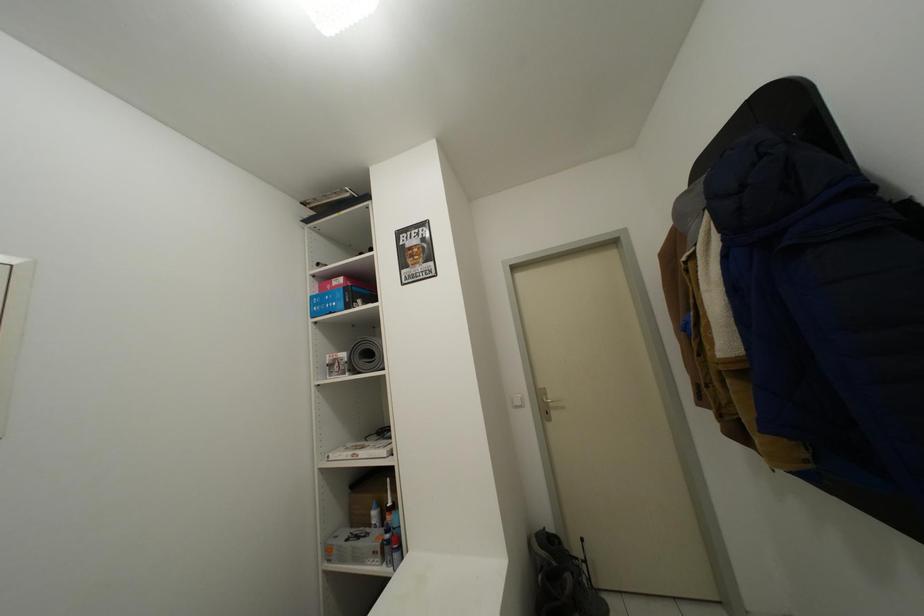
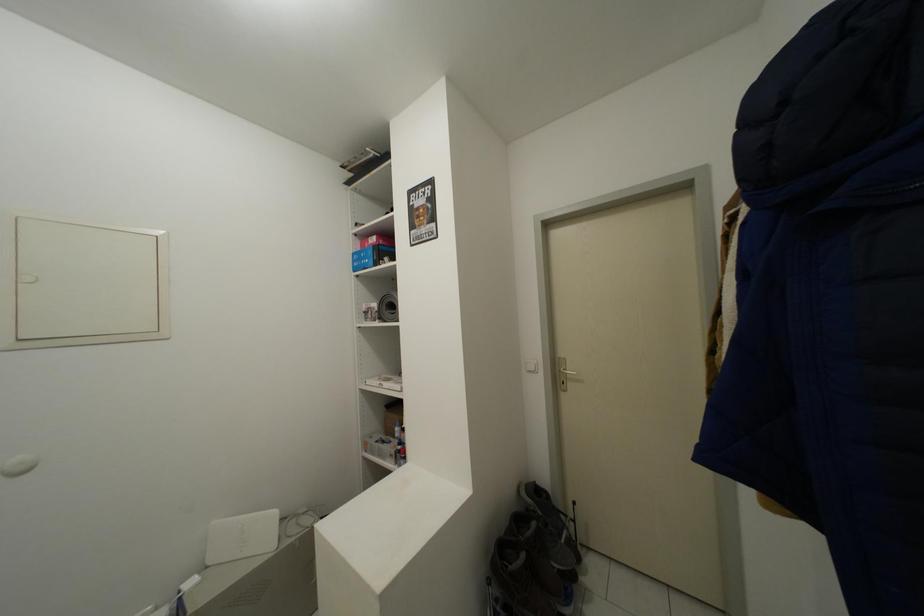
Question: Which direction would the cameraman need to move to produce the second image? Reply with the corresponding letter.

Choices:
 (A) Left
 (B) Right
 (C) Forward
 (D) Backward

Answer: (B)